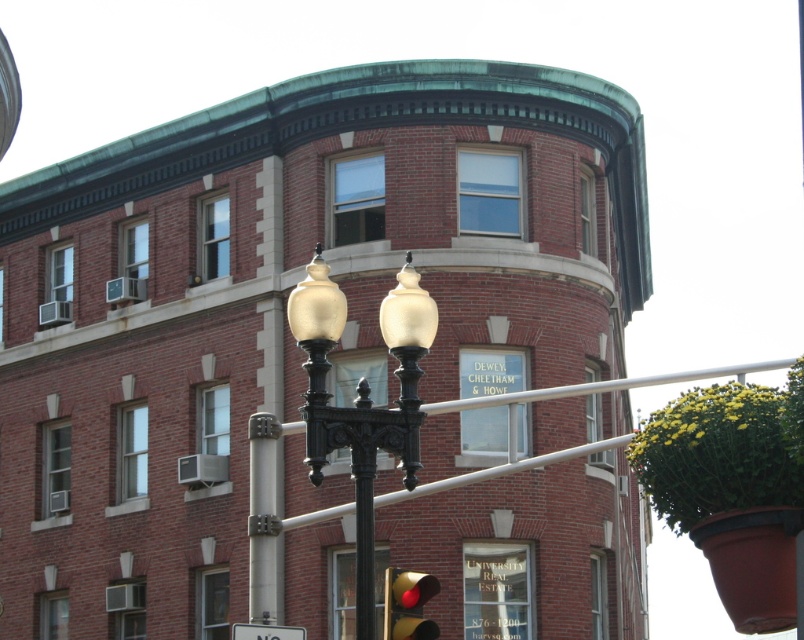
Who is positioned more to the right, matte gold streetlight at center or matte red traffic light at lower center?

matte red traffic light at lower center is more to the right.

Between point (343, 426) and point (386, 612), which one is positioned in front?

Point (386, 612) is more forward.

Where is `matte gold streetlight at center`? matte gold streetlight at center is located at coordinates (362, 400).

Which is above, matte red traffic light at lower center or white plastic sign at lower center?

matte red traffic light at lower center is above.

Does matte red traffic light at lower center appear under white plastic sign at lower center?

No.

Is point (415, 576) farther from viewer compared to point (277, 625)?

That is False.

Locate an element on the screen. The width and height of the screenshot is (804, 640). matte red traffic light at lower center is located at coordinates (408, 604).

From the picture: Can you confirm if matte gold streetlight at center is positioned to the left of white plastic sign at lower center?

Incorrect, matte gold streetlight at center is not on the left side of white plastic sign at lower center.

Measure the distance between matte gold streetlight at center and white plastic sign at lower center.

3.22 meters

Measure the distance between point (x=362, y=412) and camera.

Point (x=362, y=412) is 93.64 feet from camera.

The width and height of the screenshot is (804, 640). I want to click on matte gold streetlight at center, so click(362, 400).